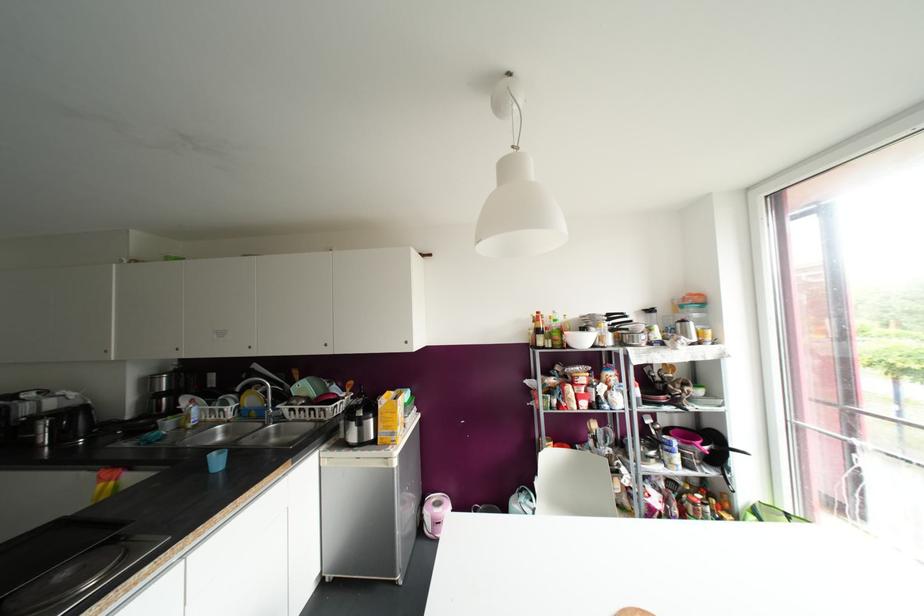
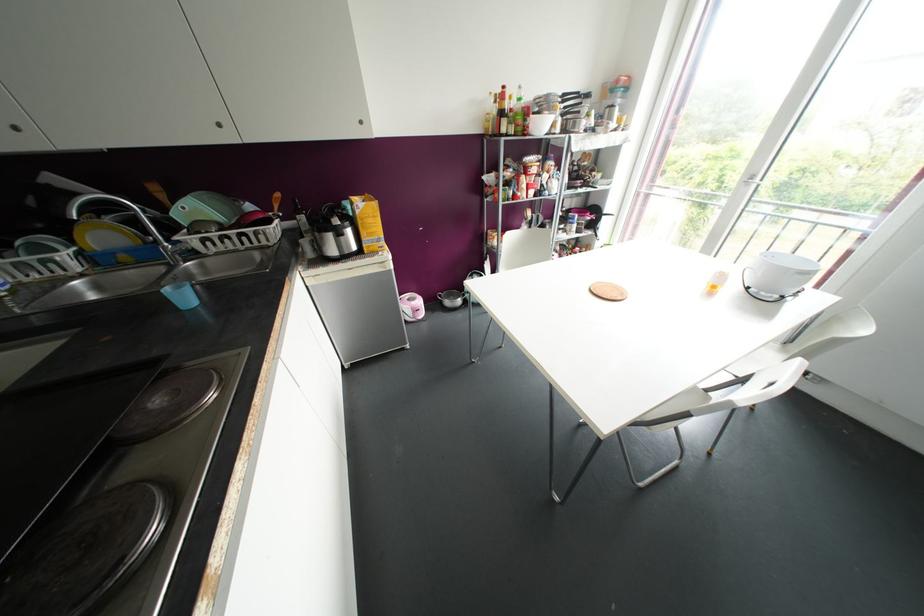
Find the pixel in the second image that matches point (278, 418) in the first image.

(192, 253)